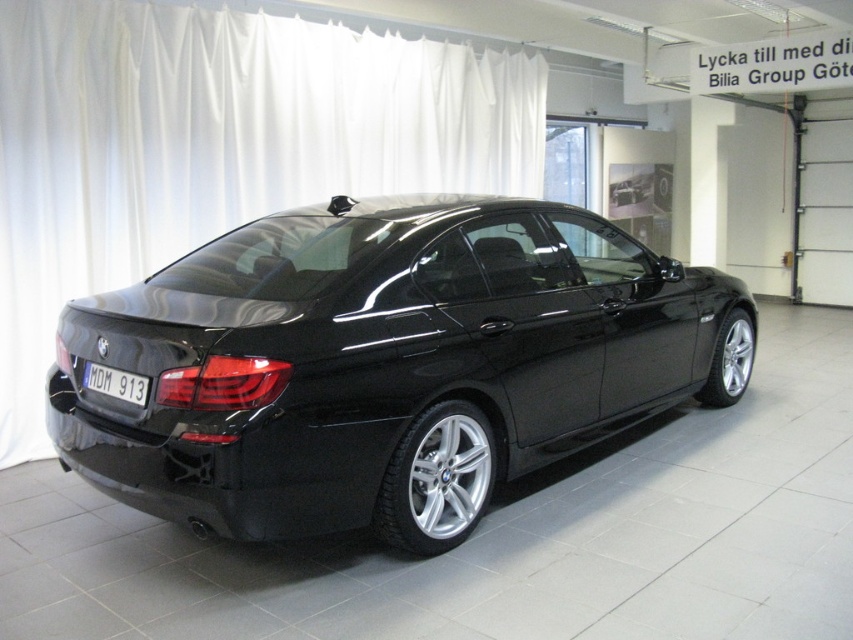
From the picture: Can you confirm if black glossy sedan at center is shorter than white matte curtain at upper center?

Indeed, black glossy sedan at center has a lesser height compared to white matte curtain at upper center.

Between point (135, 429) and point (231, 164), which one is positioned in front?

Point (135, 429) is in front.

The image size is (853, 640). I want to click on black glossy sedan at center, so click(x=386, y=364).

Is white matte curtain at upper center to the left of black plastic license plate at lower center from the viewer's perspective?

In fact, white matte curtain at upper center is to the right of black plastic license plate at lower center.

Is point (181, 220) more distant than point (96, 387)?

Yes, it is behind point (96, 387).

Where is `white matte curtain at upper center`? This screenshot has height=640, width=853. white matte curtain at upper center is located at coordinates (213, 147).

Is black glossy sedan at center further to the viewer compared to black plastic license plate at lower center?

That is False.

Does black glossy sedan at center appear under black plastic license plate at lower center?

No.

Between point (271, 403) and point (120, 387), which one is positioned behind?

Point (120, 387)

This screenshot has height=640, width=853. I want to click on black glossy sedan at center, so click(386, 364).